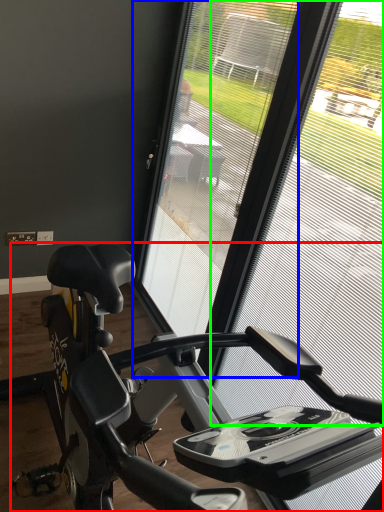
Question: Considering the real-world distances, which object is closest to stationary bicycle (highlighted by a red box)? screen door (highlighted by a blue box) or window screen (highlighted by a green box).

Choices:
 (A) screen door
 (B) window screen

Answer: (A)